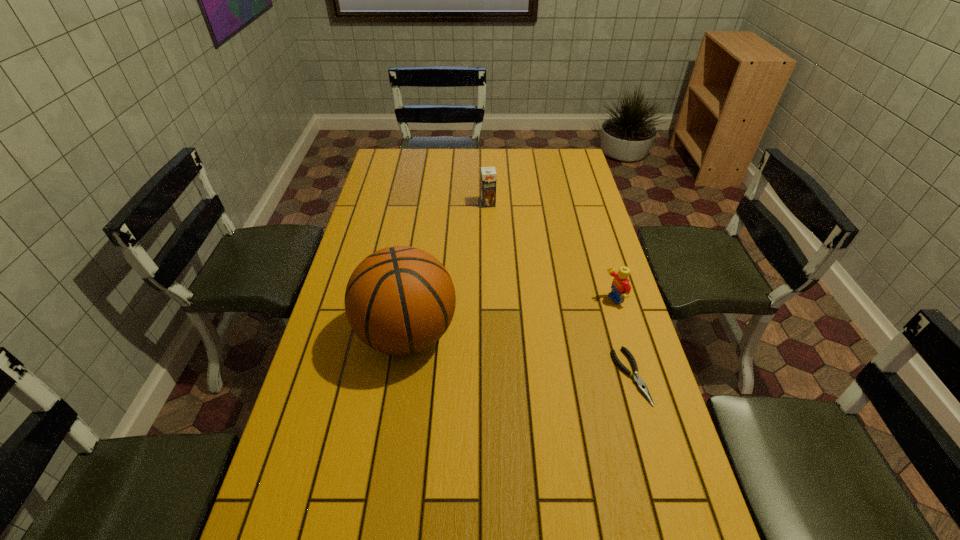
Locate an element on the screen. The width and height of the screenshot is (960, 540). vacant space on the desktop that is between the leftmost object and the shortest object and is positioned on the face of the Lego is located at coordinates (483, 348).

At what (x,y) coordinates should I click in order to perform the action: click on vacant spot on the desktop that is between the basketball and the shortest object and is positioned on the front label of the chocolate milk. Please return your answer as a coordinate pair (x, y). The image size is (960, 540). Looking at the image, I should click on (523, 356).